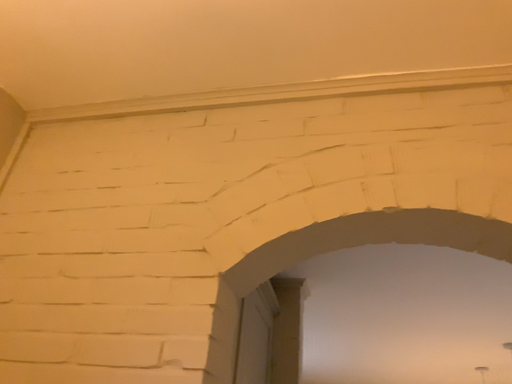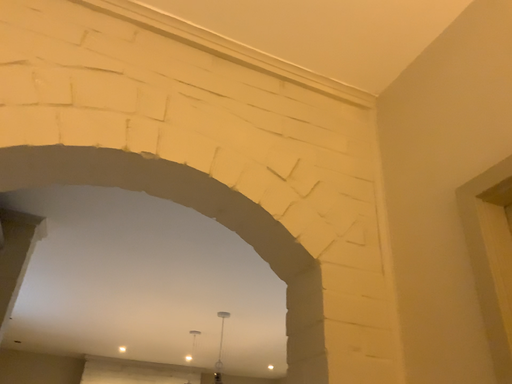
Question: Which way did the camera rotate in the video?

Choices:
 (A) rotated upward
 (B) rotated downward

Answer: (B)